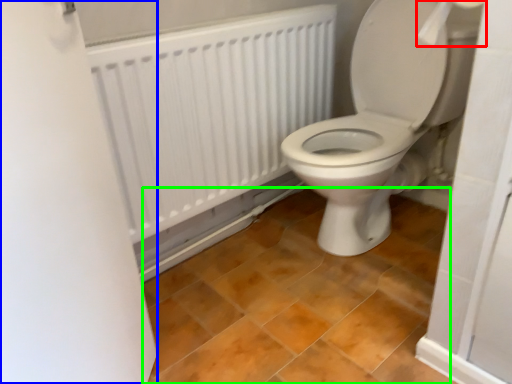
Question: Which is farther away from toilet paper (highlighted by a red box)? screen door (highlighted by a blue box) or ceramic tile (highlighted by a green box)?

Choices:
 (A) screen door
 (B) ceramic tile

Answer: (B)